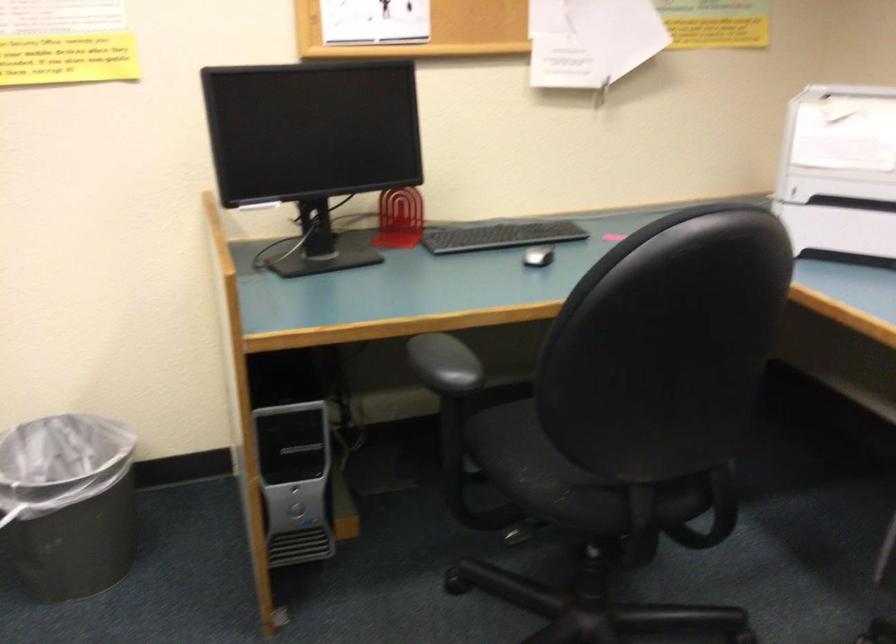
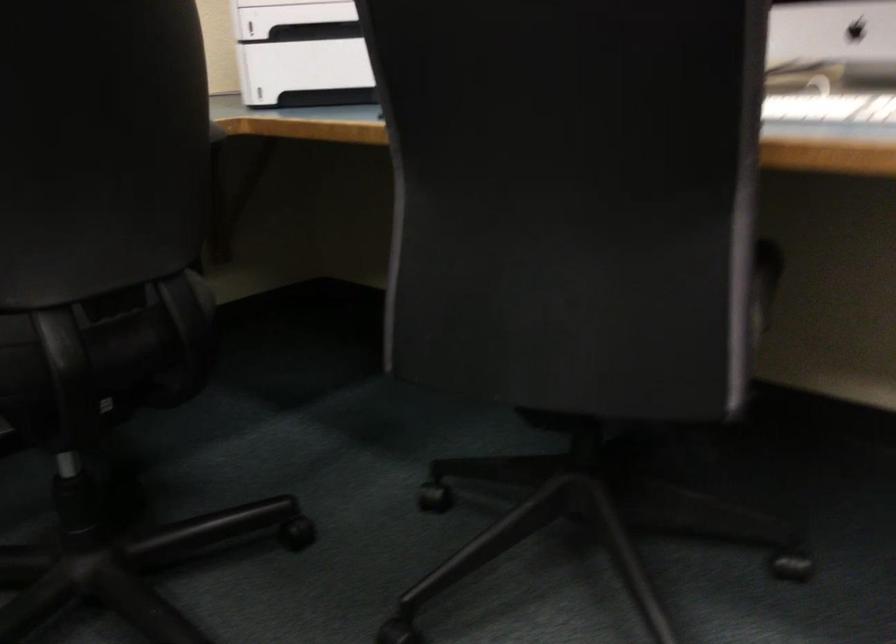
Where in the second image is the point corresponding to the point at 824,173 from the first image?

(291, 17)